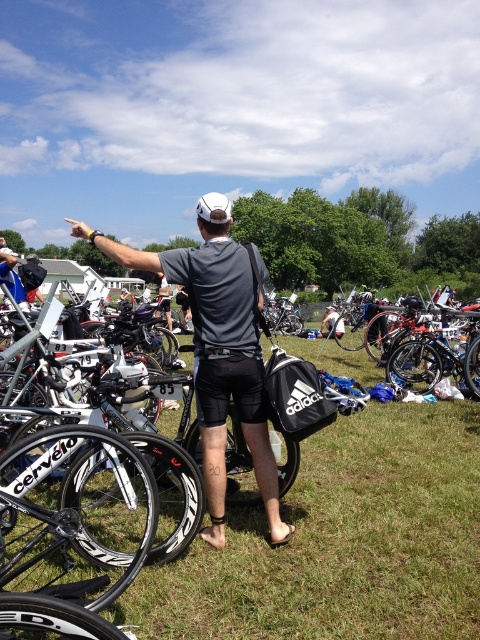
Between green grass at center and gray matte shirt at center, which one appears on the right side from the viewer's perspective?

green grass at center

At what (x,y) coordinates should I click in order to perform the action: click on green grass at center. Please return your answer as a coordinate pair (x, y). This screenshot has height=640, width=480. Looking at the image, I should click on (343, 541).

Who is lower down, shiny black bicycle at center or white matte shorts at center?

shiny black bicycle at center is below.

Is shiny black bicycle at center shorter than white matte shorts at center?

No.

Is point (425, 376) positioned before point (330, 324)?

Yes, it is in front of point (330, 324).

Locate an element on the screen. shiny black bicycle at center is located at coordinates (424, 344).

Looking at this image, measure the distance between gray matte shirt at center and white matte shorts at center.

gray matte shirt at center is 12.48 meters from white matte shorts at center.

Who is more distant from viewer, (224, 337) or (343, 330)?

Positioned behind is point (343, 330).

Is point (211, 442) closer to camera compared to point (328, 336)?

Yes, it is.

You are a GUI agent. You are given a task and a screenshot of the screen. Output one action in this format:
    pyautogui.click(x=<x>, y=<y>)
    Task: Click on the gray matte shirt at center
    This screenshot has height=640, width=480.
    Given the screenshot: What is the action you would take?
    pyautogui.click(x=216, y=352)